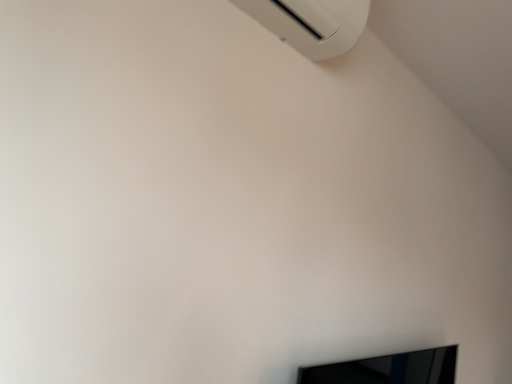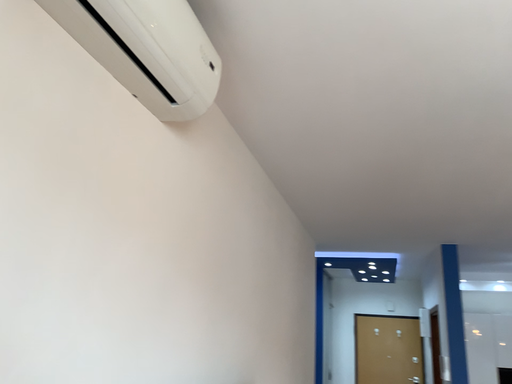
Question: How did the camera likely rotate when shooting the video?

Choices:
 (A) rotated right
 (B) rotated left

Answer: (A)